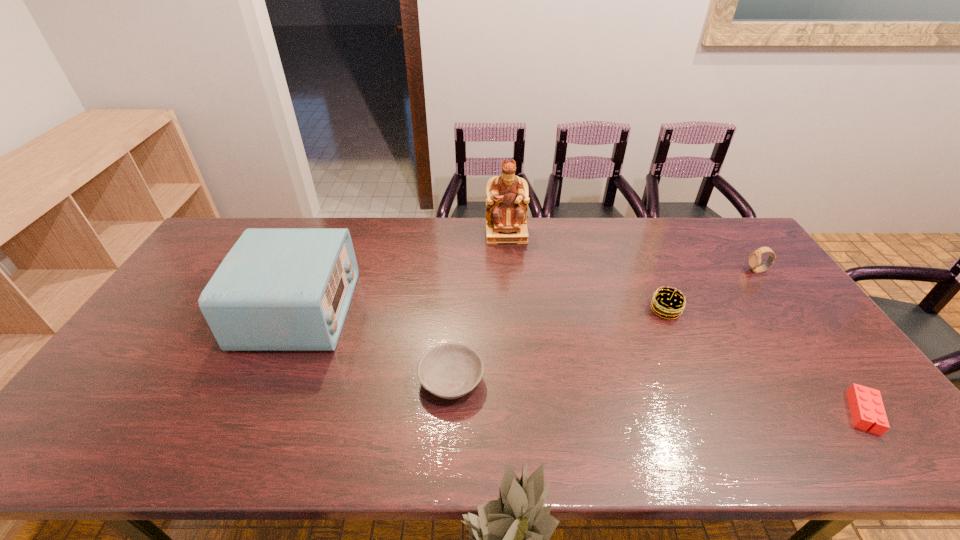
You are a GUI agent. You are given a task and a screenshot of the screen. Output one action in this format:
    pyautogui.click(x=<x>, y=<y>)
    Task: Click on the watch at the right edge
    The height and width of the screenshot is (540, 960).
    Given the screenshot: What is the action you would take?
    pyautogui.click(x=754, y=260)

At what (x,y) coordinates should I click in order to perform the action: click on Lego present at the right edge. Please return your answer as a coordinate pair (x, y). This screenshot has height=540, width=960. Looking at the image, I should click on (866, 405).

Image resolution: width=960 pixels, height=540 pixels. Identify the location of object present at the near right corner. (866, 405).

Image resolution: width=960 pixels, height=540 pixels. What are the coordinates of `free space at the far edge of the desktop` in the screenshot? It's located at (684, 242).

Identify the location of free space at the near edge of the desktop. The image size is (960, 540). (436, 429).

Find the location of `vacant area at the right edge`. vacant area at the right edge is located at coordinates (756, 295).

Locate an element on the screen. The height and width of the screenshot is (540, 960). free space at the near right corner of the desktop is located at coordinates [x=847, y=438].

You are a GUI agent. You are given a task and a screenshot of the screen. Output one action in this format:
    pyautogui.click(x=<x>, y=<y>)
    Task: Click on the empty space between the third shortest object and the shortest object
    This screenshot has width=960, height=540.
    Given the screenshot: What is the action you would take?
    pyautogui.click(x=764, y=361)

Where is `vacant space in between the shortest object and the fourth object from left to right`? This screenshot has width=960, height=540. vacant space in between the shortest object and the fourth object from left to right is located at coordinates [x=764, y=361].

At what (x,y) coordinates should I click in order to perform the action: click on free space that is in between the fourth object from left to right and the second shortest object. Please return your answer as a coordinate pair (x, y). Looking at the image, I should click on (559, 345).